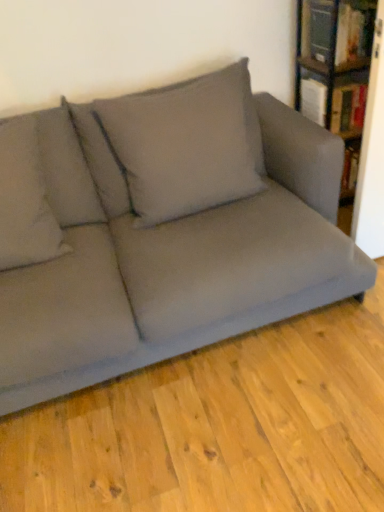
Question: Can you see wooden bookshelf at upper right touching matte gray couch at center?

Choices:
 (A) yes
 (B) no

Answer: (B)

Question: Is wooden bookshelf at upper right not near matte gray couch at center?

Choices:
 (A) yes
 (B) no

Answer: (B)

Question: Considering the relative sizes of wooden bookshelf at upper right and matte gray couch at center in the image provided, is wooden bookshelf at upper right wider than matte gray couch at center?

Choices:
 (A) no
 (B) yes

Answer: (A)

Question: From a real-world perspective, is wooden bookshelf at upper right located beneath matte gray couch at center?

Choices:
 (A) yes
 (B) no

Answer: (B)

Question: Is wooden bookshelf at upper right turned away from matte gray couch at center?

Choices:
 (A) yes
 (B) no

Answer: (B)

Question: Is wooden bookshelf at upper right at the right side of matte gray couch at center?

Choices:
 (A) yes
 (B) no

Answer: (A)

Question: From a real-world perspective, does wooden bookshelf at upper right sit lower than hardcover book at upper right, which is the first book from top to bottom?

Choices:
 (A) no
 (B) yes

Answer: (B)

Question: Is wooden bookshelf at upper right at the left side of hardcover book at upper right, which is the 2th book in bottom-to-top order?

Choices:
 (A) no
 (B) yes

Answer: (A)

Question: Is wooden bookshelf at upper right looking in the opposite direction of hardcover book at upper right, which is the first book from top to bottom?

Choices:
 (A) yes
 (B) no

Answer: (A)

Question: Is wooden bookshelf at upper right to the right of hardcover book at upper right, which is the first book from top to bottom, from the viewer's perspective?

Choices:
 (A) no
 (B) yes

Answer: (B)

Question: Considering the relative positions of wooden bookshelf at upper right and hardcover book at upper right, which is the first book from top to bottom, in the image provided, is wooden bookshelf at upper right behind hardcover book at upper right, which is the first book from top to bottom,?

Choices:
 (A) no
 (B) yes

Answer: (A)

Question: Is wooden bookshelf at upper right not close to hardcover book at upper right, which is the first book from top to bottom?

Choices:
 (A) yes
 (B) no

Answer: (B)

Question: Does hardcover book at upper right, which is the first book from top to bottom, have a smaller size compared to gray fabric pillow at upper center, acting as the 1th pillow starting from the right?

Choices:
 (A) no
 (B) yes

Answer: (B)